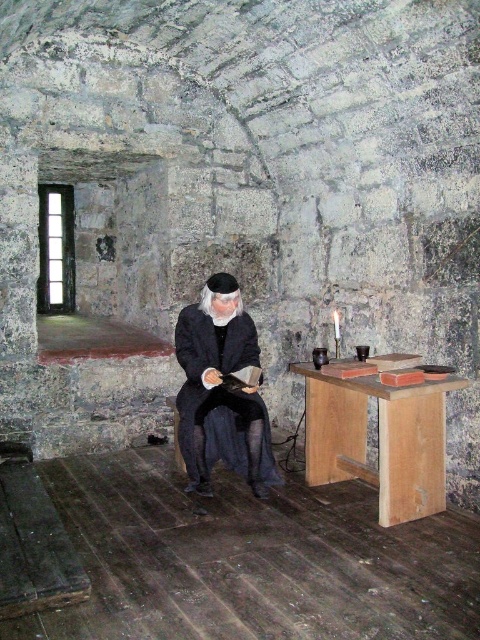
Does wooden table at center have a greater height compared to dark woolen robe at center?

No, wooden table at center is not taller than dark woolen robe at center.

Does wooden table at center have a lesser width compared to dark woolen robe at center?

In fact, wooden table at center might be wider than dark woolen robe at center.

Which is in front, point (365, 456) or point (207, 365)?

Point (207, 365)

Find the location of `wooden table at center`. wooden table at center is located at coordinates (379, 440).